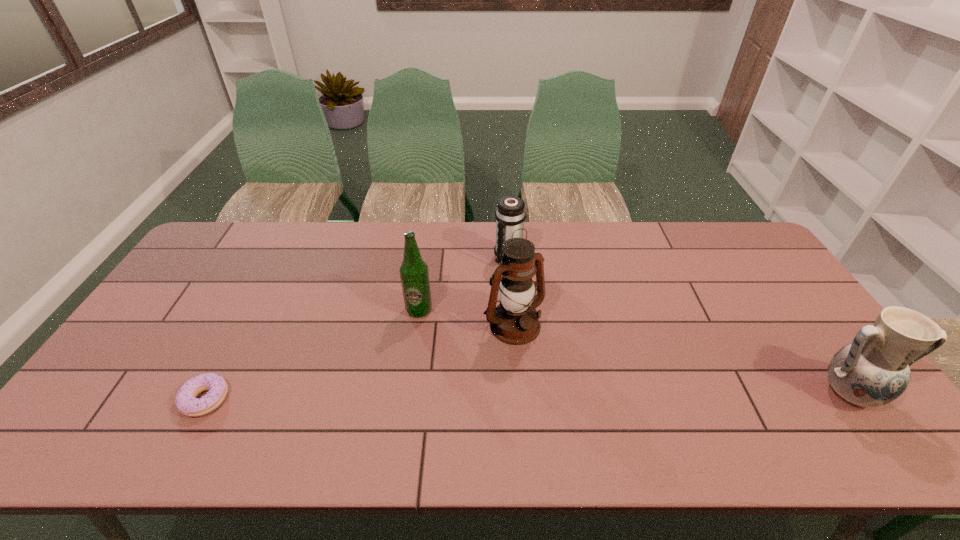
This screenshot has width=960, height=540. I want to click on object that is at the right edge, so click(x=873, y=370).

What are the coordinates of `object that is at the near right corner` in the screenshot? It's located at (873, 370).

Find the location of a particular element. The width and height of the screenshot is (960, 540). free space at the far edge of the desktop is located at coordinates (436, 239).

Identify the location of free space at the left edge. The height and width of the screenshot is (540, 960). (202, 299).

Where is `vacant region at the right edge of the desktop`? This screenshot has width=960, height=540. vacant region at the right edge of the desktop is located at coordinates (821, 339).

This screenshot has width=960, height=540. I want to click on free space between the second shortest object and the pottery, so click(678, 326).

The height and width of the screenshot is (540, 960). In order to click on vacant point located between the pottery and the tallest object in this screenshot , I will do `click(681, 359)`.

Where is `free area in between the leftmost object and the rightmost object`? free area in between the leftmost object and the rightmost object is located at coordinates (527, 396).

This screenshot has width=960, height=540. Identify the location of unoccupied position between the lantern and the beer bottle. click(467, 318).

Locate an element on the screen. Image resolution: width=960 pixels, height=540 pixels. free point between the shortest object and the pottery is located at coordinates (527, 396).